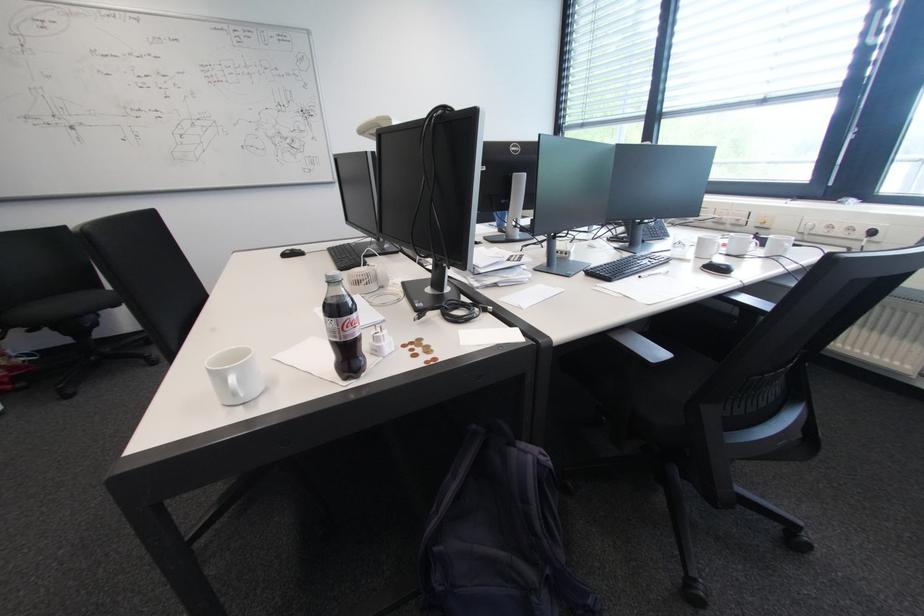
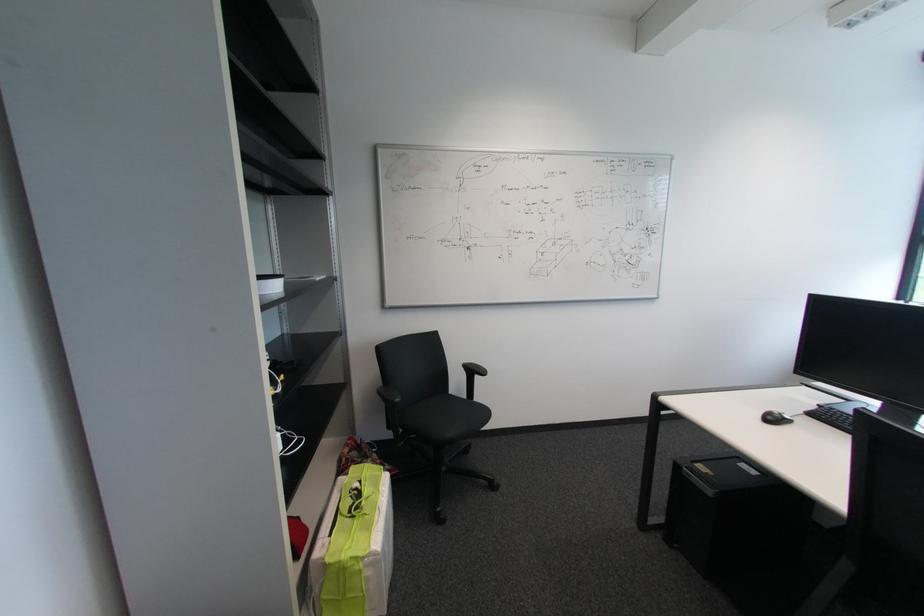
Find the pixel in the second image that matches the point at 295,254 in the first image.

(775, 418)